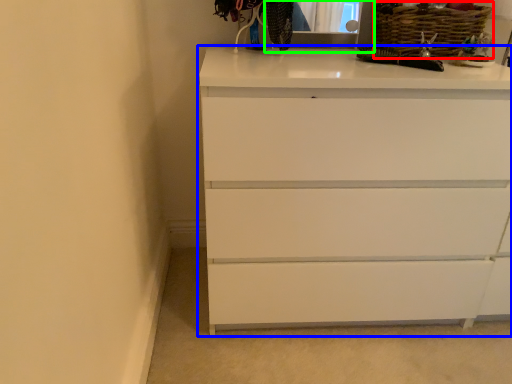
Question: Which is farther away from basket (highlighted by a red box)? chest of drawers (highlighted by a blue box) or medicine cabinet (highlighted by a green box)?

Choices:
 (A) chest of drawers
 (B) medicine cabinet

Answer: (A)